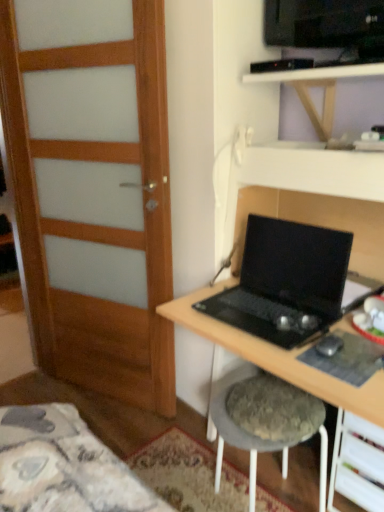
Question: In terms of size, does wooden at upper center appear bigger or smaller than black matte laptop at center?

Choices:
 (A) small
 (B) big

Answer: (B)

Question: In terms of height, does wooden at upper center look taller or shorter compared to black matte laptop at center?

Choices:
 (A) tall
 (B) short

Answer: (B)

Question: Estimate the real-world distances between objects in this image. Which object is closer to the wooden at upper center?

Choices:
 (A) black matte laptop at center
 (B) white plastic drawer at lower right
 (C) fuzzy fabric stool at lower center
 (D) wooden door at left
 (E) black matte desk at center

Answer: (A)

Question: Which is nearer to the fuzzy fabric stool at lower center?

Choices:
 (A) black rubber mouse at lower right
 (B) wooden at upper center
 (C) wooden door at left
 (D) white plastic drawer at lower right
 (E) black matte desk at center

Answer: (D)